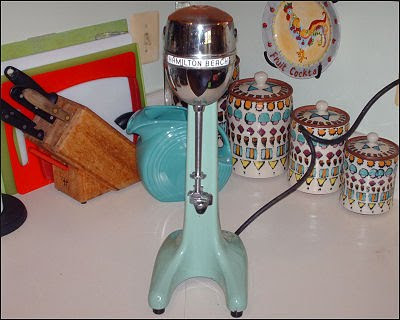
This screenshot has height=320, width=400. I want to click on white plate, so click(206, 68).